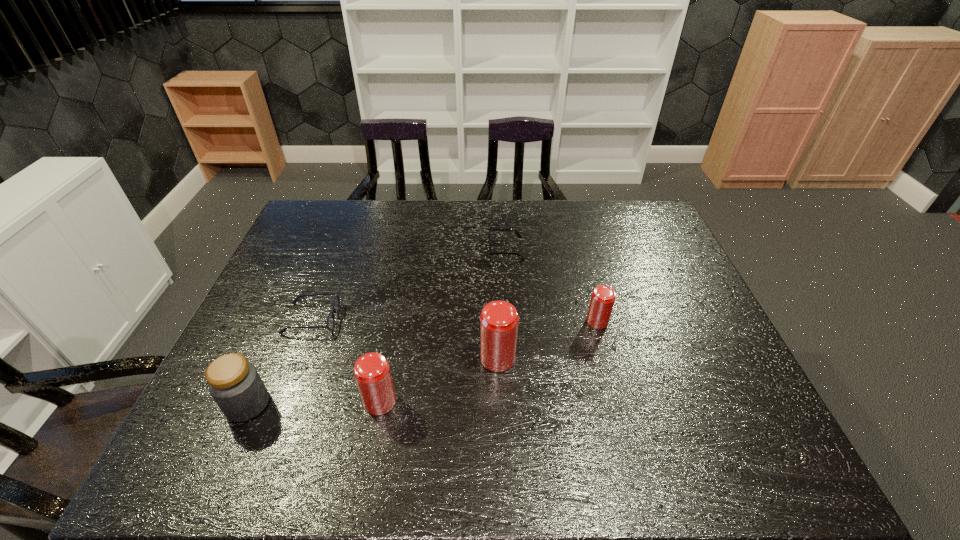
Locate an element on the screen. free space located 0.050m on the right of the third nearest object is located at coordinates (536, 358).

In order to click on blank space located 0.120m on the front of the rightmost beer can in this screenshot , I will do `click(610, 367)`.

I want to click on free space located on the front-facing side of the farthest object, so click(418, 248).

Identify the location of vacant point located on the front-facing side of the farthest object. coord(405,248).

Identify the location of vacant space located on the front-facing side of the farthest object. Image resolution: width=960 pixels, height=540 pixels. [x=454, y=248].

At what (x,y) coordinates should I click in order to perform the action: click on vacant area situated on the front-facing side of the spectacles. Please return your answer as a coordinate pair (x, y). Image resolution: width=960 pixels, height=540 pixels. Looking at the image, I should click on [x=398, y=319].

Identify the location of vacant space positioned 0.200m on the surface of the jar near the warning symbol. (356, 404).

This screenshot has width=960, height=540. Identify the location of object that is at the far edge. (490, 229).

The image size is (960, 540). What are the coordinates of `beer can that is at the near edge` in the screenshot? It's located at (372, 373).

You are a GUI agent. You are given a task and a screenshot of the screen. Output one action in this format:
    pyautogui.click(x=<x>, y=<y>)
    Task: Click on the jar at the near edge
    The height and width of the screenshot is (540, 960).
    Given the screenshot: What is the action you would take?
    pyautogui.click(x=234, y=383)